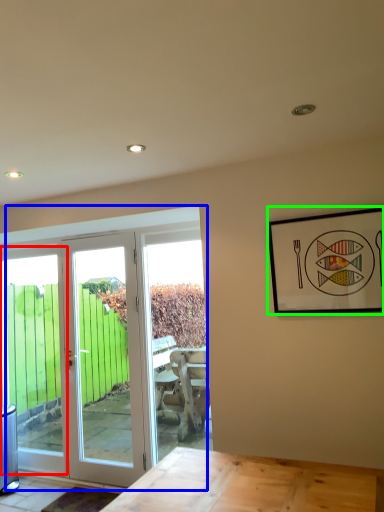
Question: Which object is the farthest from window (highlighted by a red box)? Choose among these: door (highlighted by a blue box) or picture frame (highlighted by a green box).

Choices:
 (A) door
 (B) picture frame

Answer: (B)